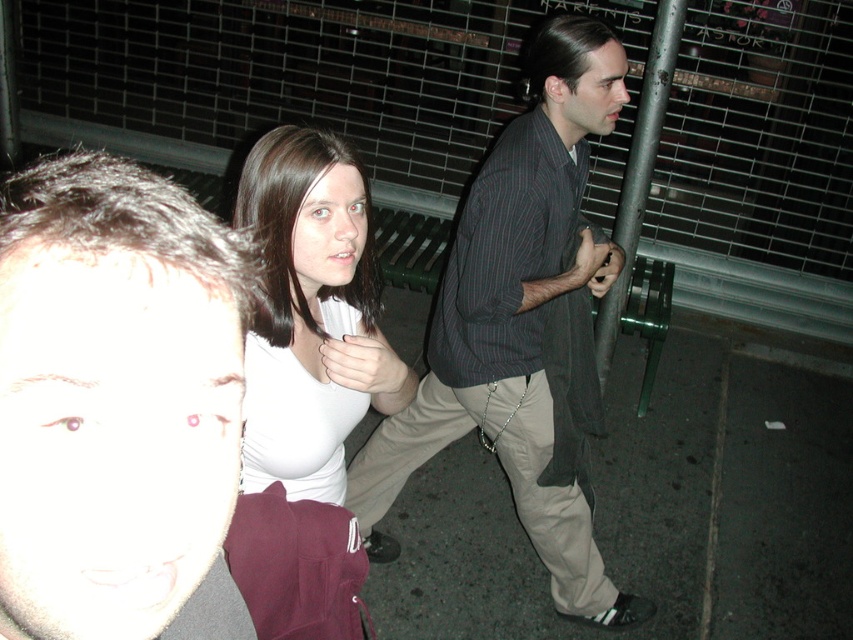
Question: Estimate the real-world distances between objects in this image. Which object is closer to the smooth skin face at lower left?

Choices:
 (A) khaki pants at center
 (B) white matte shirt at center

Answer: (B)

Question: Which object is positioned closest to the white matte shirt at center?

Choices:
 (A) khaki pants at center
 (B) smooth skin face at lower left

Answer: (A)

Question: Based on their relative distances, which object is nearer to the smooth skin face at lower left?

Choices:
 (A) white matte shirt at center
 (B) khaki pants at center

Answer: (A)

Question: Does smooth skin face at lower left have a smaller size compared to khaki pants at center?

Choices:
 (A) yes
 (B) no

Answer: (A)

Question: Where is khaki pants at center located in relation to white matte shirt at center in the image?

Choices:
 (A) left
 (B) right

Answer: (B)

Question: Does smooth skin face at lower left have a larger size compared to white matte shirt at center?

Choices:
 (A) no
 (B) yes

Answer: (A)